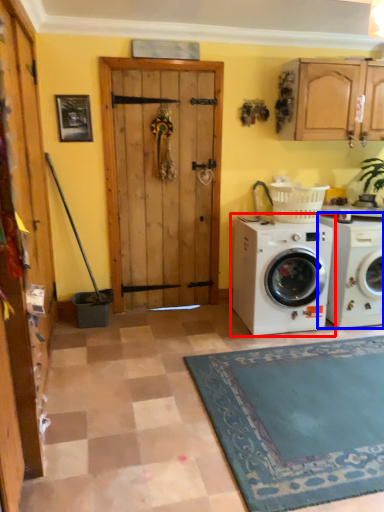
Question: Which object is closer to the camera taking this photo, washing machine (highlighted by a red box) or washing machine (highlighted by a blue box)?

Choices:
 (A) washing machine
 (B) washing machine

Answer: (A)